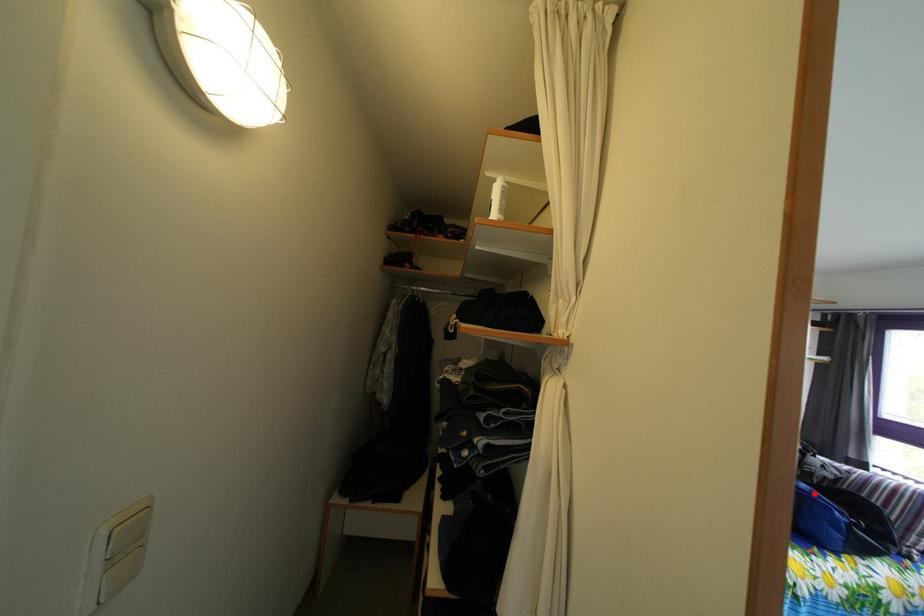
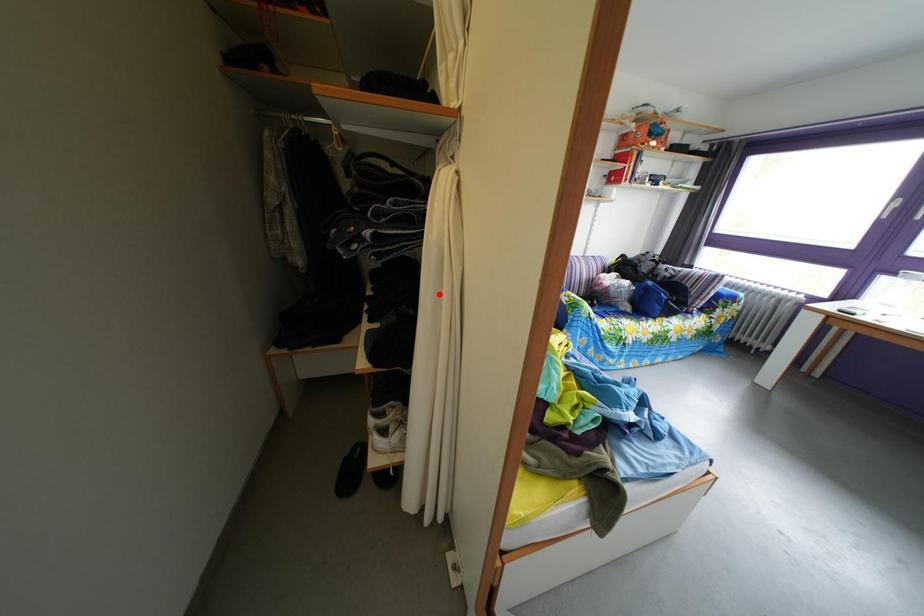
I am providing you with two images of the same scene from different viewpoints. A red point is marked on the first image and another point is marked on the second image. Are the points marked in image1 and image2 representing the same 3D position?

No